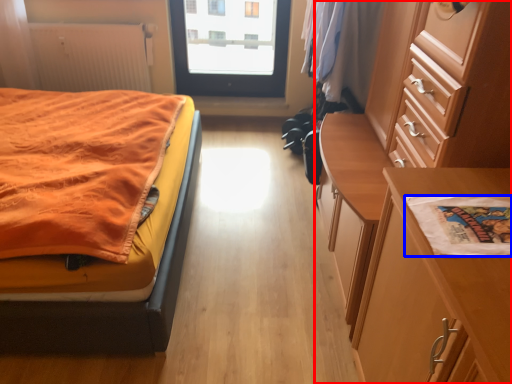
Question: Which object appears farthest to the camera in this image, chest of drawers (highlighted by a red box) or linen (highlighted by a blue box)?

Choices:
 (A) chest of drawers
 (B) linen

Answer: (A)